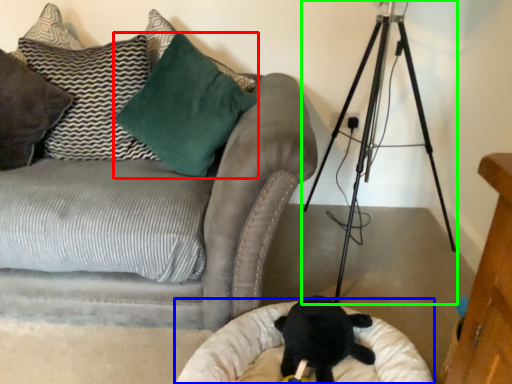
Question: Based on their relative distances, which object is farther from pillow (highlighted by a red box)? Choose from cat bed (highlighted by a blue box) and tripod (highlighted by a green box).

Choices:
 (A) cat bed
 (B) tripod

Answer: (A)